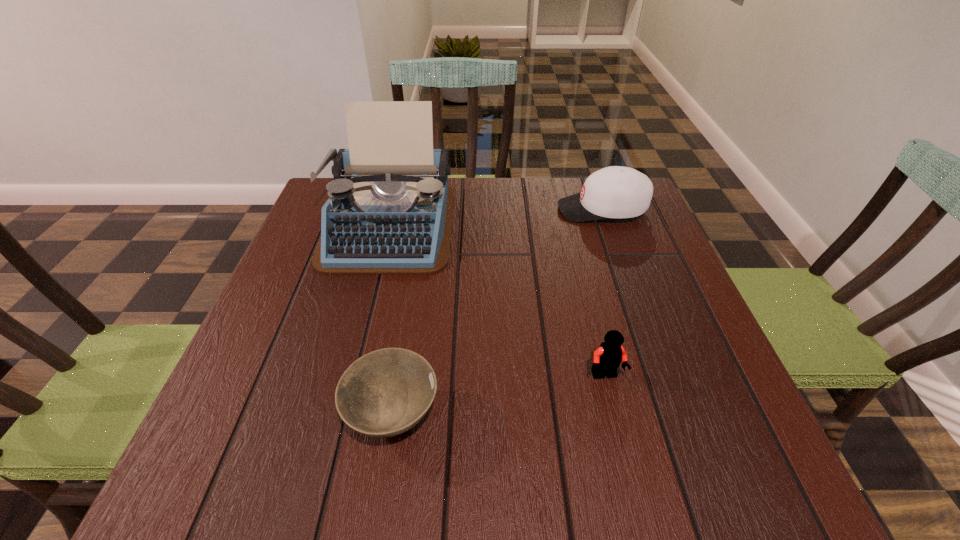
Where is `the tallest object`? This screenshot has width=960, height=540. the tallest object is located at coordinates (390, 208).

The width and height of the screenshot is (960, 540). Find the location of `baseball cap`. baseball cap is located at coordinates (613, 192).

Find the location of a particular element. Lego is located at coordinates (607, 358).

Find the location of a particular element. the shortest object is located at coordinates (386, 392).

This screenshot has height=540, width=960. In order to click on free space located 0.070m on the typing side of the typewriter in this screenshot , I will do `click(370, 296)`.

Locate an element on the screen. free location located 0.320m on the front-facing side of the baseball cap is located at coordinates (438, 210).

Identify the location of vacant region located 0.400m on the front-facing side of the baseball cap. This screenshot has width=960, height=540. (408, 210).

At what (x,y) coordinates should I click in order to perform the action: click on free spot located 0.110m on the front-facing side of the baseball cap. Please return your answer as a coordinate pair (x, y). The height and width of the screenshot is (540, 960). Looking at the image, I should click on (516, 210).

What are the coordinates of `vacant area located 0.170m on the front-facing side of the Lego` in the screenshot? It's located at (632, 484).

Locate an element on the screen. Image resolution: width=960 pixels, height=540 pixels. vacant space located 0.180m on the left of the shortest object is located at coordinates (239, 415).